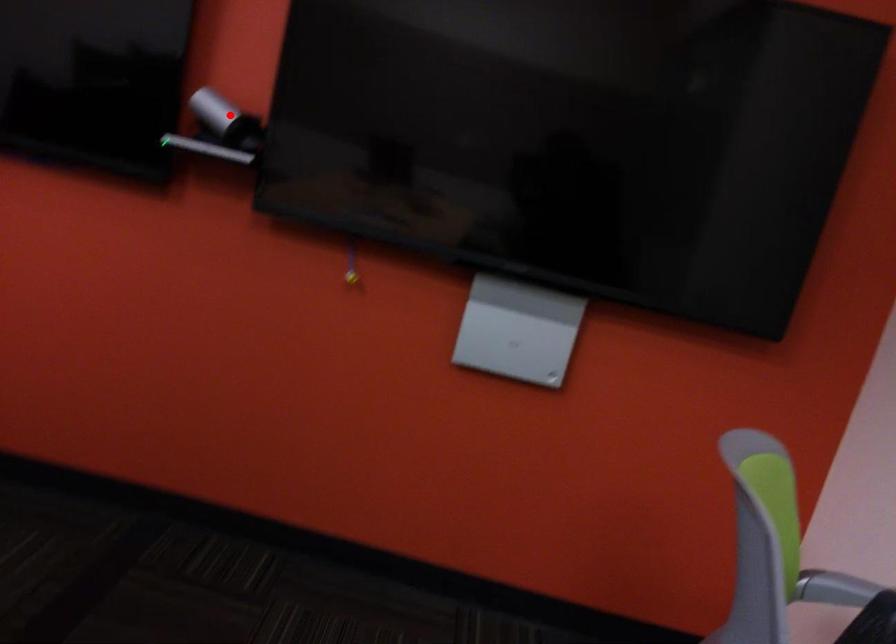
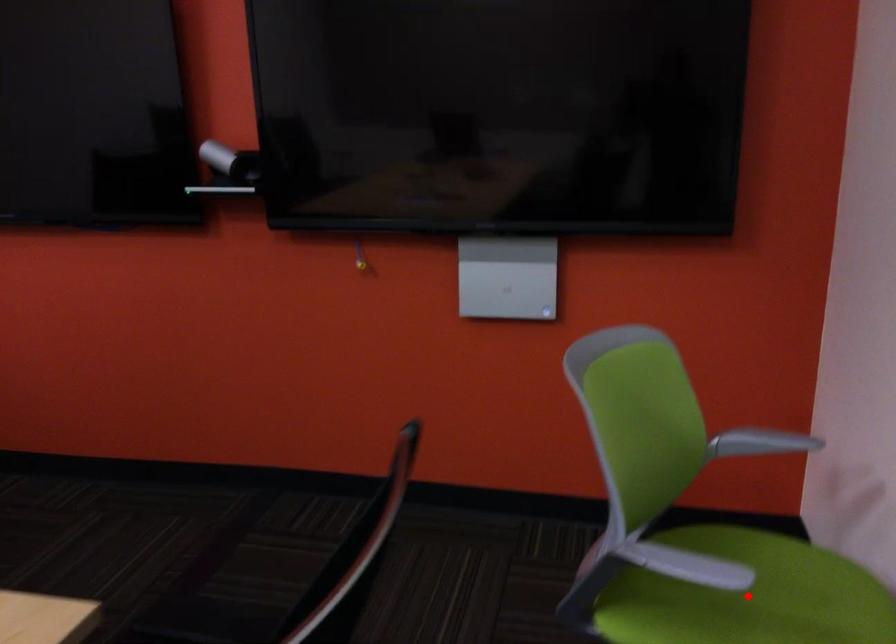
I am providing you with two images of the same scene from different viewpoints. A red point is marked on the first image and another point is marked on the second image. Does the point marked in image1 correspond to the same location as the one in image2?

No